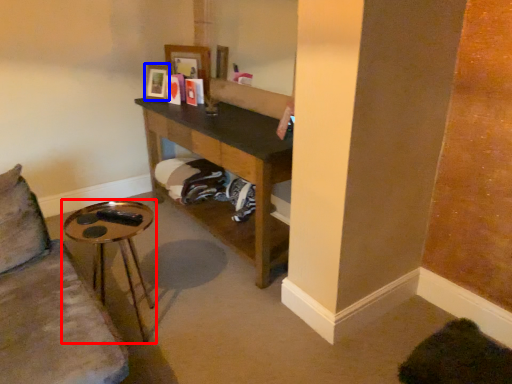
Question: Among these objects, which one is nearest to the camera, table (highlighted by a red box) or picture frame (highlighted by a blue box)?

Choices:
 (A) table
 (B) picture frame

Answer: (A)